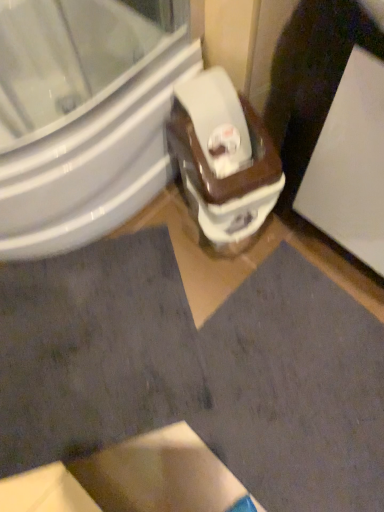
The image size is (384, 512). I want to click on vacant space in front of white glossy toilet at center, so click(206, 276).